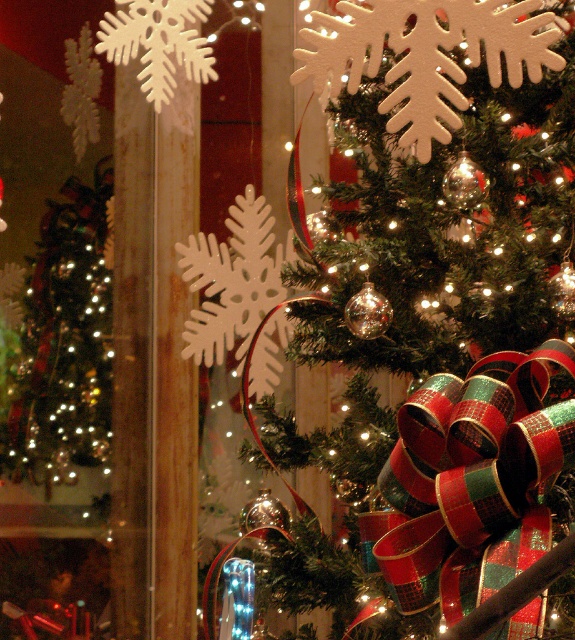
You are standing in front of the Christmas tree scene. You want to hang a new ornament on the green matte christmas tree at center. Is the shiny gold ornaments at left currently positioned above or below the tree?

The green matte christmas tree at center is above the shiny gold ornaments at left, so the shiny gold ornaments at left are positioned below the tree.

You are standing in front of the Christmas tree scene. You want to take a photo of the green matte christmas tree at center and the shiny gold ornaments at left. Which object will appear larger in your photo?

The green matte christmas tree at center will appear larger in your photo because it is closer to the viewer than the shiny gold ornaments at left.

You are standing in the room where the green matte christmas tree at center is located. If you face the tree and look directly ahead, will you see the reflection of another tree through the window behind it?

The green matte christmas tree at center is positioned at point (x=431, y=324). Since the reflection of another tree is visible through the window in the background, facing the tree and looking directly ahead would allow you to see the reflection of the other tree through the window behind it.